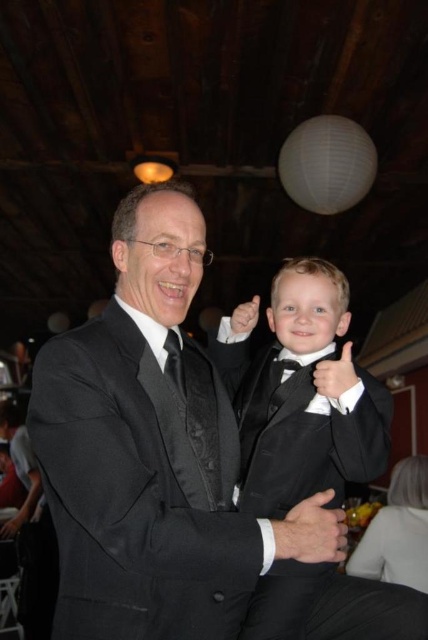
Is black satin tie at center in front of black satin bow tie at center?

Yes, it is.

Based on the photo, does black satin tie at center have a lesser width compared to black satin bow tie at center?

No, black satin tie at center is not thinner than black satin bow tie at center.

Between point (214, 480) and point (291, 369), which one is positioned in front?

Point (214, 480) is in front.

The width and height of the screenshot is (428, 640). Identify the location of black satin tie at center. (195, 404).

What are the coordinates of `black satin tuxedo at center` in the screenshot? It's located at (302, 394).

How far apart are black satin tuxedo at center and black satin tie at center?

black satin tuxedo at center is 10.40 inches from black satin tie at center.

Which is in front, point (281, 582) or point (189, 413)?

Positioned in front is point (189, 413).

What are the coordinates of `black satin tuxedo at center` in the screenshot? It's located at (302, 394).

This screenshot has height=640, width=428. Describe the element at coordinates (302, 394) in the screenshot. I see `black satin tuxedo at center` at that location.

Can you confirm if black satin tuxedo at center is shorter than black satin bow tie at center?

No.

Is point (389, 628) positioned before point (294, 362)?

Yes.

Where is `black satin tuxedo at center`? black satin tuxedo at center is located at coordinates (302, 394).